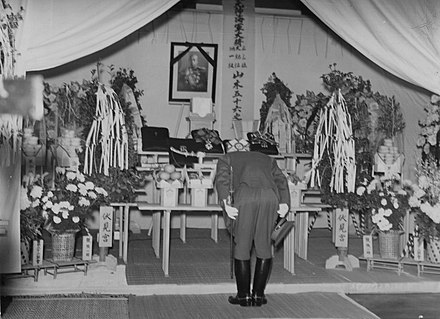
The image size is (440, 319). Identify the location of table. (192, 205).